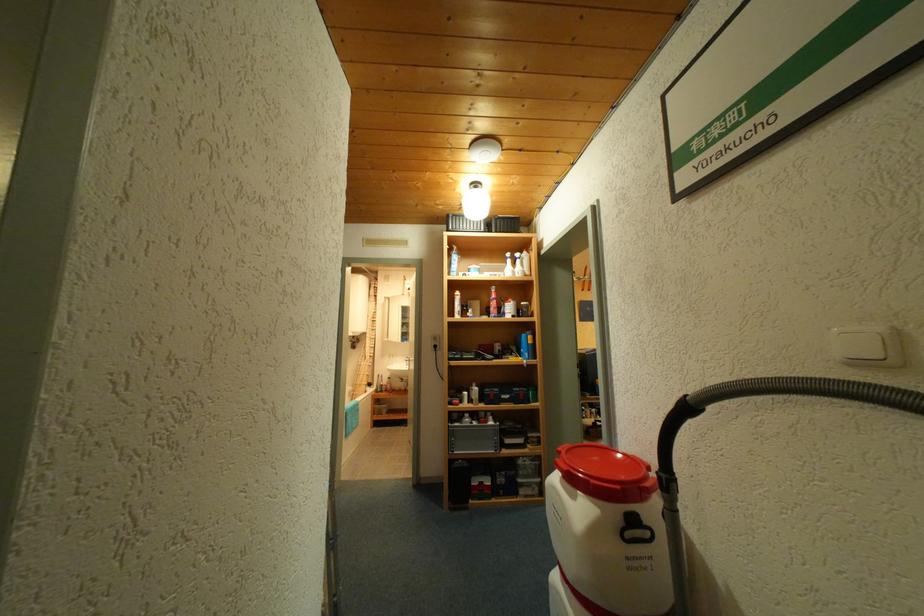
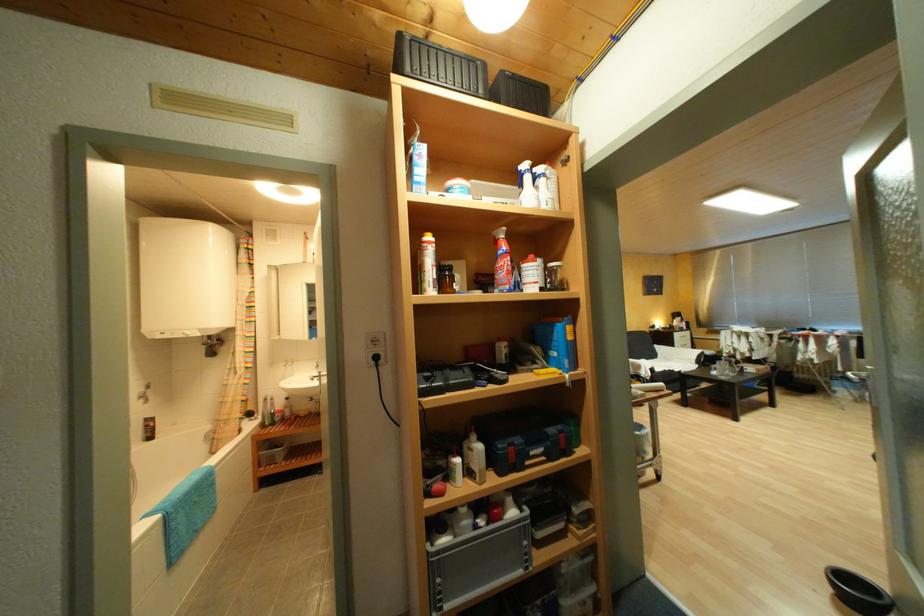
In the second image, find the point that corresponds to [483,386] in the first image.

(482, 438)